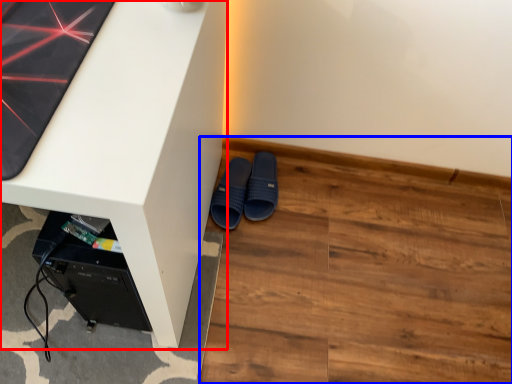
Question: Which object is closer to the camera taking this photo, desk (highlighted by a red box) or hardwood (highlighted by a blue box)?

Choices:
 (A) desk
 (B) hardwood

Answer: (A)